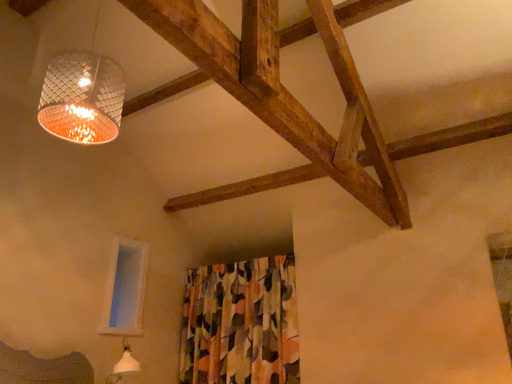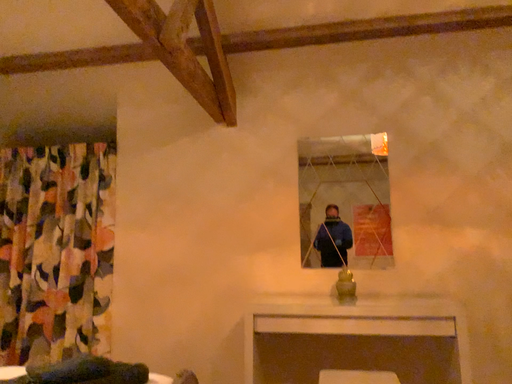
Question: How did the camera likely rotate when shooting the video?

Choices:
 (A) rotated upward
 (B) rotated downward

Answer: (B)